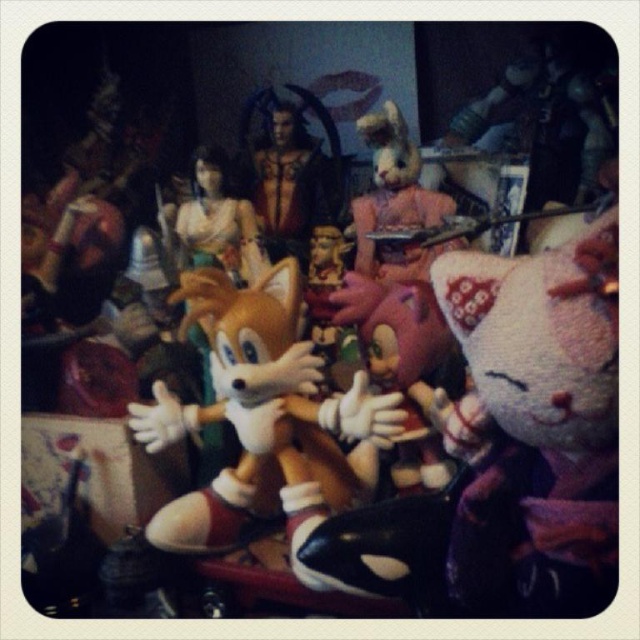
You are a child who wants to see both the fluffy orange fox at center and the fuzzy pink bunny at center clearly. Since they are both in the center, which one is closer to you?

The fluffy orange fox at center is closer to you because it is in front of the fuzzy pink bunny at center.

You are arranging a display of plush toys and need to place the fluffy orange fox at center and the fuzzy pink bunny at center. According to the scene, which one should be placed to the left of the other?

The fluffy orange fox at center should be placed to the left of the fuzzy pink bunny at center because the description states that the fluffy orange fox at center is positioned on the left side of the fuzzy pink bunny at center.

You are looking at the display of plush toys and figurines. There is a point at coordinates (260, 413). Which plush toy does this point correspond to?

The point at coordinates (260, 413) corresponds to the fluffy orange fox at center.